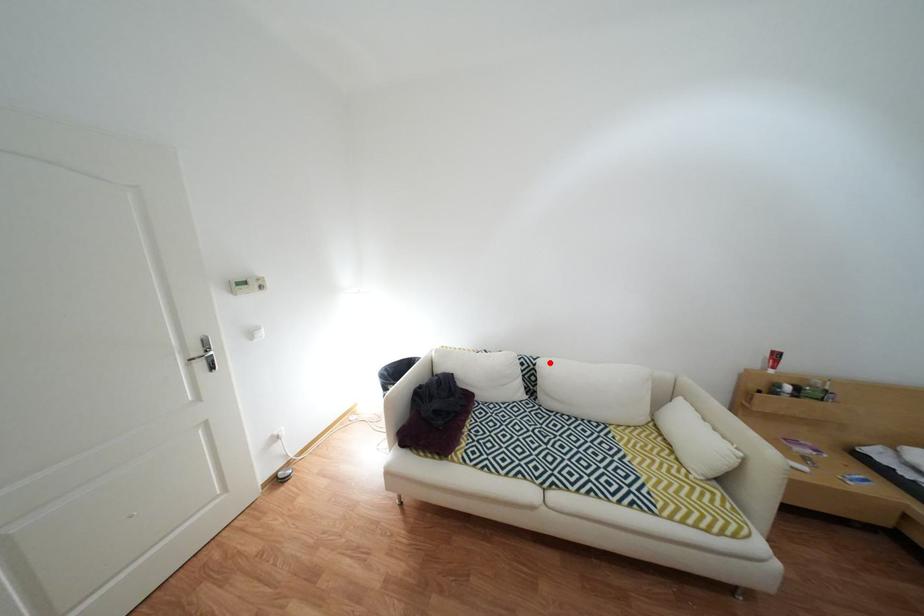
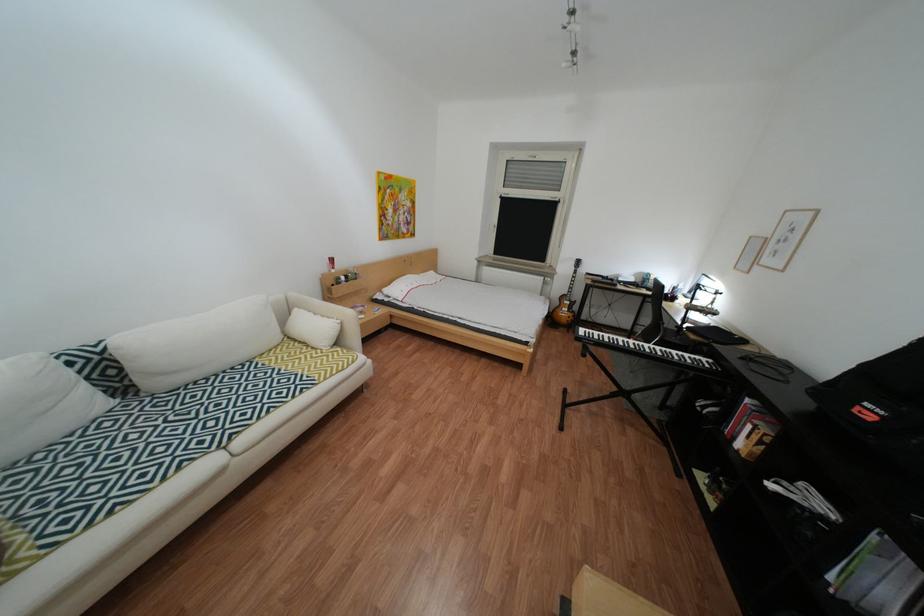
The point at the highlighted location is marked in the first image. Where is the corresponding point in the second image?

(114, 351)